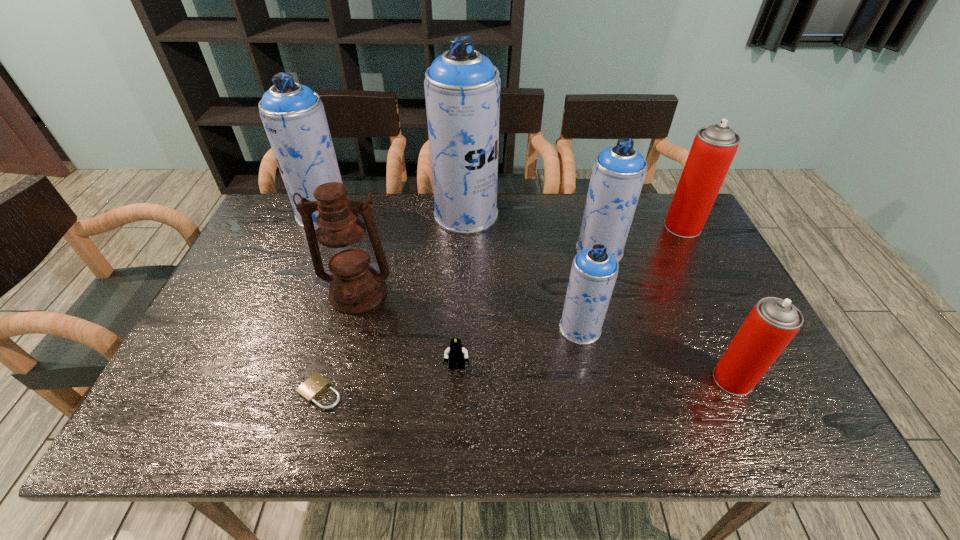
Locate an element on the screen. free location located on the left of the nearest aerosol can is located at coordinates (688, 380).

The height and width of the screenshot is (540, 960). Find the location of `free point located 0.240m on the back of the smallest blue aerosol can`. free point located 0.240m on the back of the smallest blue aerosol can is located at coordinates (x=564, y=252).

This screenshot has height=540, width=960. Identify the location of vacant space located on the front-facing side of the Lego. (454, 436).

In order to click on free space located on the left of the padlock in this screenshot , I will do `click(186, 392)`.

Locate an element on the screen. The image size is (960, 540). object present at the near edge is located at coordinates (310, 389).

Locate an element on the screen. The image size is (960, 540). object at the left edge is located at coordinates (293, 115).

This screenshot has height=540, width=960. Identify the location of object situated at the far left corner. (293, 115).

Image resolution: width=960 pixels, height=540 pixels. I want to click on object that is at the far right corner, so click(714, 147).

This screenshot has width=960, height=540. I want to click on vacant space at the far edge, so click(x=557, y=222).

Where is `vacant space at the near edge`? vacant space at the near edge is located at coordinates (261, 408).